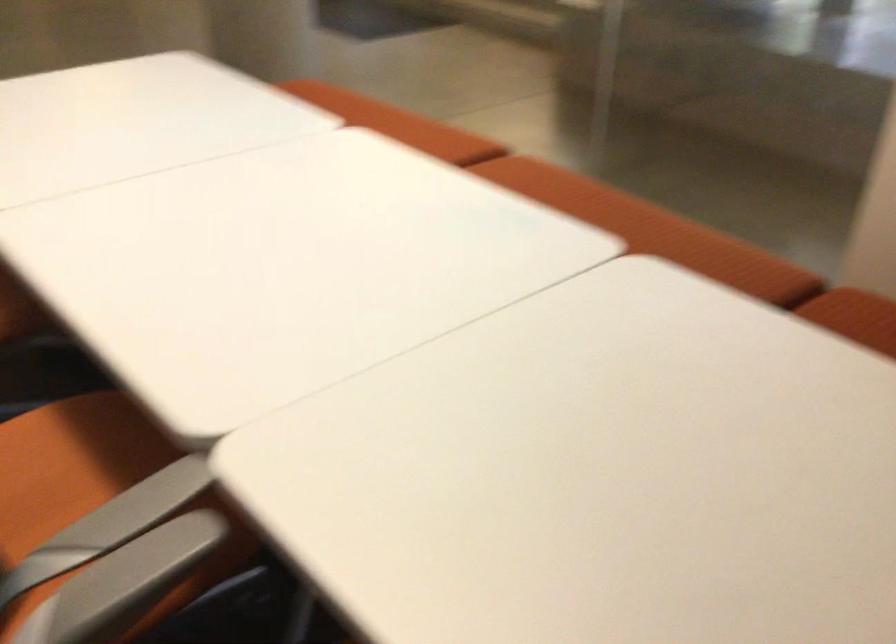
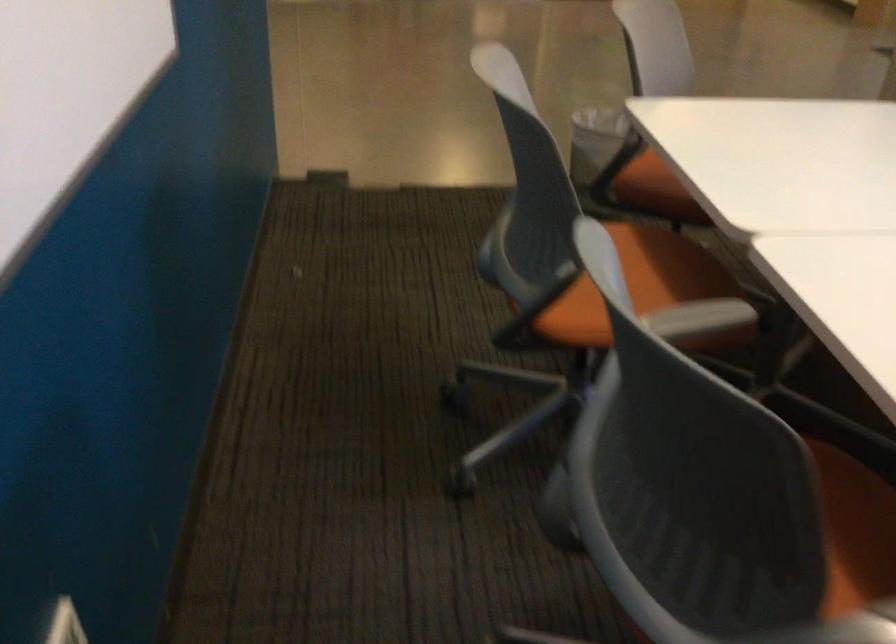
Question: How did the camera likely rotate?

Choices:
 (A) Left
 (B) Right
 (C) Up
 (D) Down

Answer: (A)